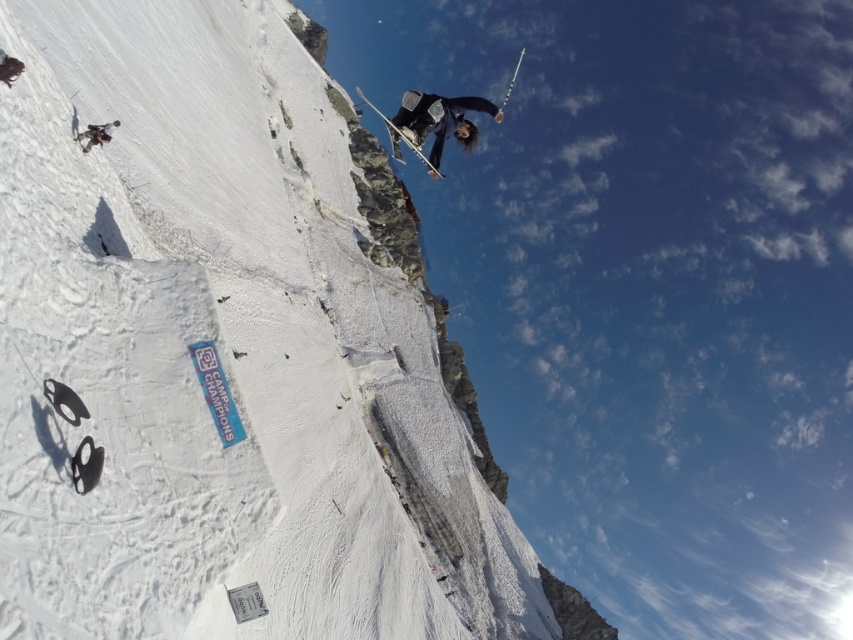
Question: Is dark blue fabric skier at upper center behind shiny metallic ski at center?

Choices:
 (A) yes
 (B) no

Answer: (B)

Question: Which point appears farthest from the camera in this image?

Choices:
 (A) (457, 128)
 (B) (97, 131)
 (C) (122, 163)
 (D) (373, 104)

Answer: (D)

Question: Which object appears farthest from the camera in this image?

Choices:
 (A) dark blue fabric skier at upper center
 (B) white snow cliff at upper center

Answer: (A)

Question: Which is nearer to the white snow cliff at upper center?

Choices:
 (A) dark blue fabric skier at upper center
 (B) shiny metallic ski at center

Answer: (A)

Question: Does dark blue fabric skier at upper center have a smaller size compared to matte black snowboarder at upper left?

Choices:
 (A) yes
 (B) no

Answer: (B)

Question: Can you confirm if white snow cliff at upper center is positioned to the right of matte black snowboarder at upper left?

Choices:
 (A) yes
 (B) no

Answer: (A)